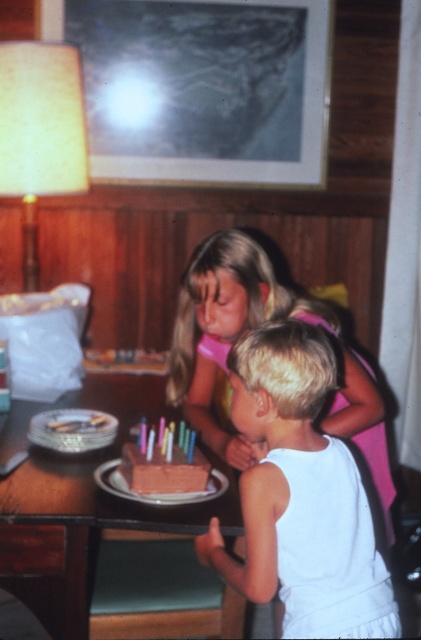
Question: Estimate the real-world distances between objects in this image. Which object is closer to the white matte tank top at center?

Choices:
 (A) chocolate cake at center
 (B) chocolate matte cake at center

Answer: (B)

Question: Can you confirm if chocolate cake at center is thinner than chocolate matte cake at center?

Choices:
 (A) yes
 (B) no

Answer: (B)

Question: Which object is closer to the camera taking this photo?

Choices:
 (A) chocolate cake at center
 (B) chocolate matte cake at center

Answer: (A)

Question: Does white matte tank top at center lie behind chocolate matte cake at center?

Choices:
 (A) yes
 (B) no

Answer: (B)

Question: Can you confirm if chocolate cake at center is positioned to the left of chocolate matte cake at center?

Choices:
 (A) no
 (B) yes

Answer: (B)

Question: Which point appears closest to the camera in this image?

Choices:
 (A) (290, 547)
 (B) (77, 592)
 (C) (194, 460)

Answer: (A)